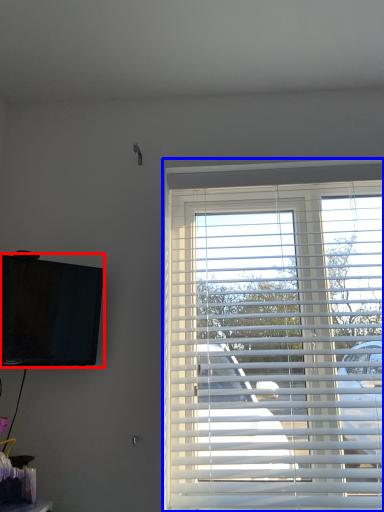
Question: Among these objects, which one is farthest to the camera, television (highlighted by a red box) or window blind (highlighted by a blue box)?

Choices:
 (A) television
 (B) window blind

Answer: (B)